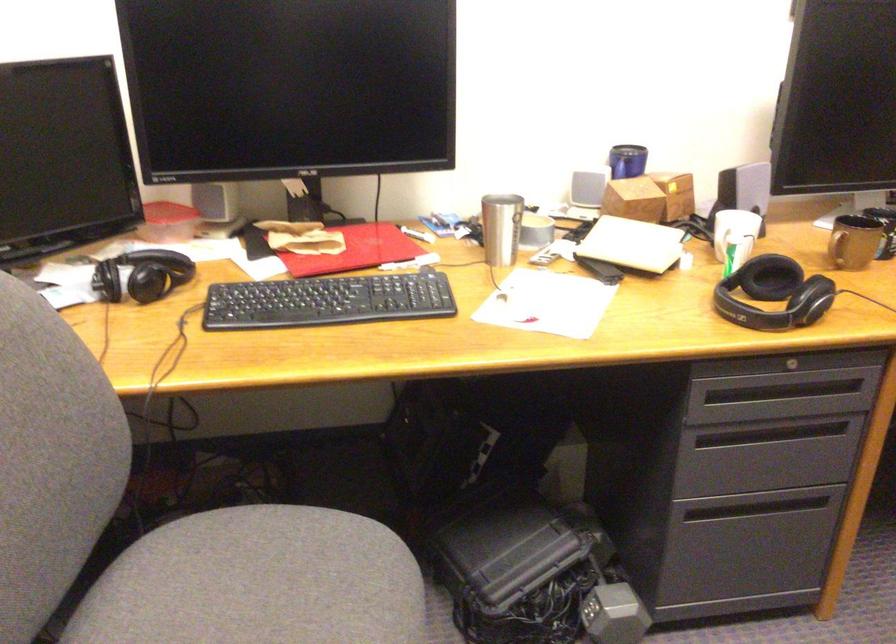
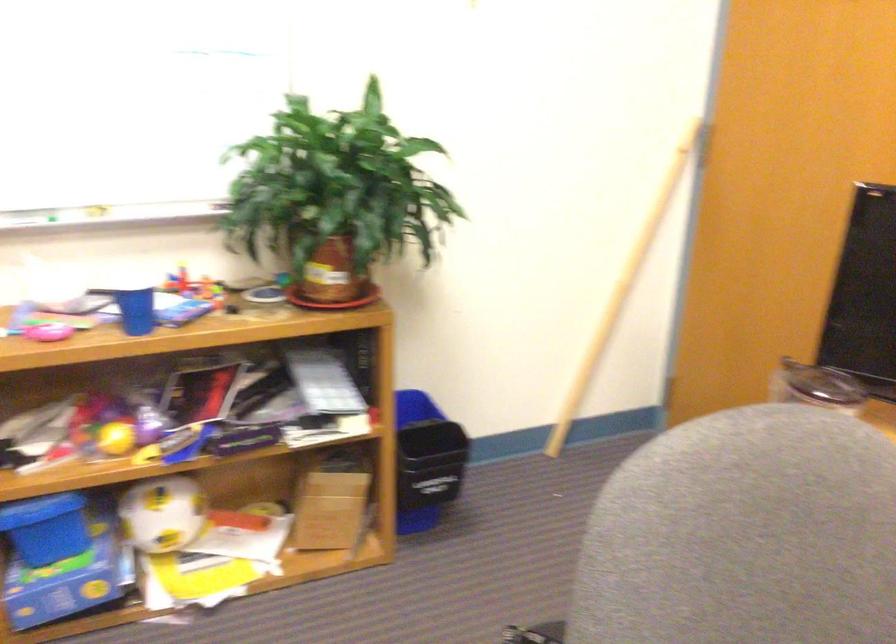
Question: The camera is either moving clockwise (left) or counter-clockwise (right) around the object. The first image is from the beginning of the video and the second image is from the end. Is the camera moving left or right when shooting the video?

Choices:
 (A) Left
 (B) Right

Answer: (B)